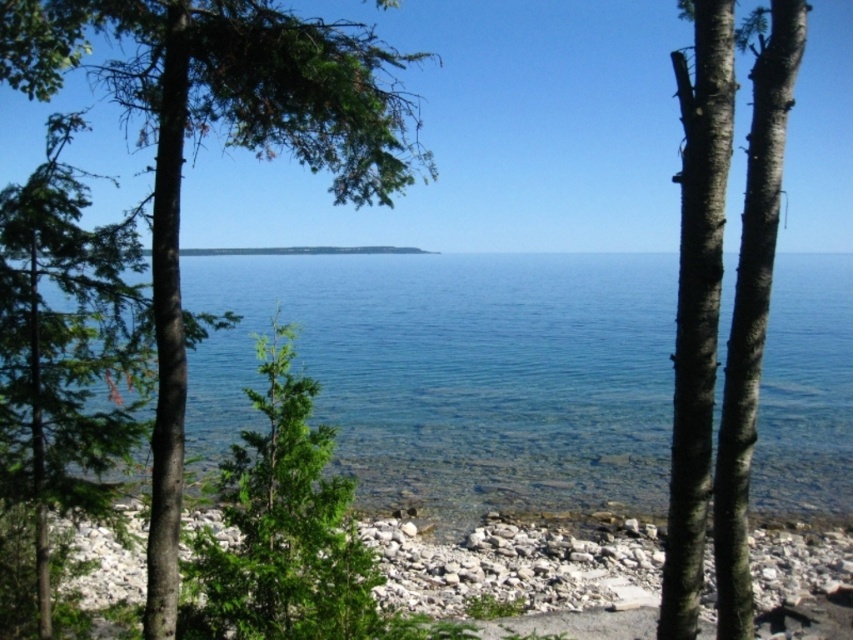
Is clear blue water at center to the right of green leafy tree at left from the viewer's perspective?

Indeed, clear blue water at center is positioned on the right side of green leafy tree at left.

Does clear blue water at center have a smaller size compared to green leafy tree at left?

Correct, clear blue water at center occupies less space than green leafy tree at left.

Where is `clear blue water at center`? clear blue water at center is located at coordinates (456, 372).

The width and height of the screenshot is (853, 640). Describe the element at coordinates (456, 372) in the screenshot. I see `clear blue water at center` at that location.

Can you confirm if clear blue water at center is thinner than white pebbles at lower center?

In fact, clear blue water at center might be wider than white pebbles at lower center.

The image size is (853, 640). Describe the element at coordinates (456, 372) in the screenshot. I see `clear blue water at center` at that location.

This screenshot has width=853, height=640. What are the coordinates of `clear blue water at center` in the screenshot? It's located at (456, 372).

Between clear blue water at center and smooth bark tree at right, which one is positioned higher?

Positioned higher is clear blue water at center.

Find the location of a particular element. The height and width of the screenshot is (640, 853). clear blue water at center is located at coordinates (456, 372).

Where is `clear blue water at center`? clear blue water at center is located at coordinates (456, 372).

At what (x,y) coordinates should I click in order to perform the action: click on clear blue water at center. Please return your answer as a coordinate pair (x, y). Looking at the image, I should click on (456, 372).